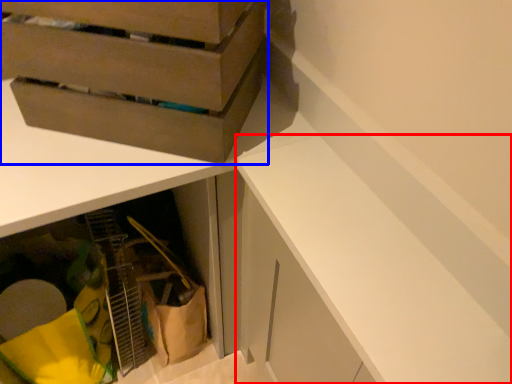
Question: Among these objects, which one is farthest to the camera, cabinetry (highlighted by a red box) or cardboard box (highlighted by a blue box)?

Choices:
 (A) cabinetry
 (B) cardboard box

Answer: (B)